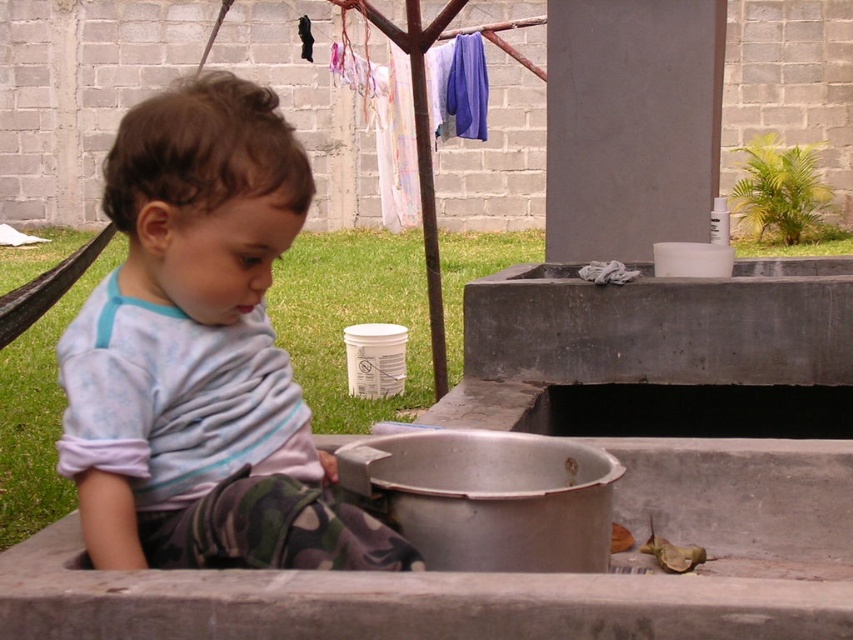
Is light blue cotton shirt at center to the left of silver metallic basin at lower center from the viewer's perspective?

Indeed, light blue cotton shirt at center is positioned on the left side of silver metallic basin at lower center.

Is light blue cotton shirt at center below silver metallic basin at lower center?

No.

Which is in front, point (106, 554) or point (415, 490)?

Point (106, 554)

At what (x,y) coordinates should I click in order to perform the action: click on light blue cotton shirt at center. Please return your answer as a coordinate pair (x, y). Looking at the image, I should click on (201, 355).